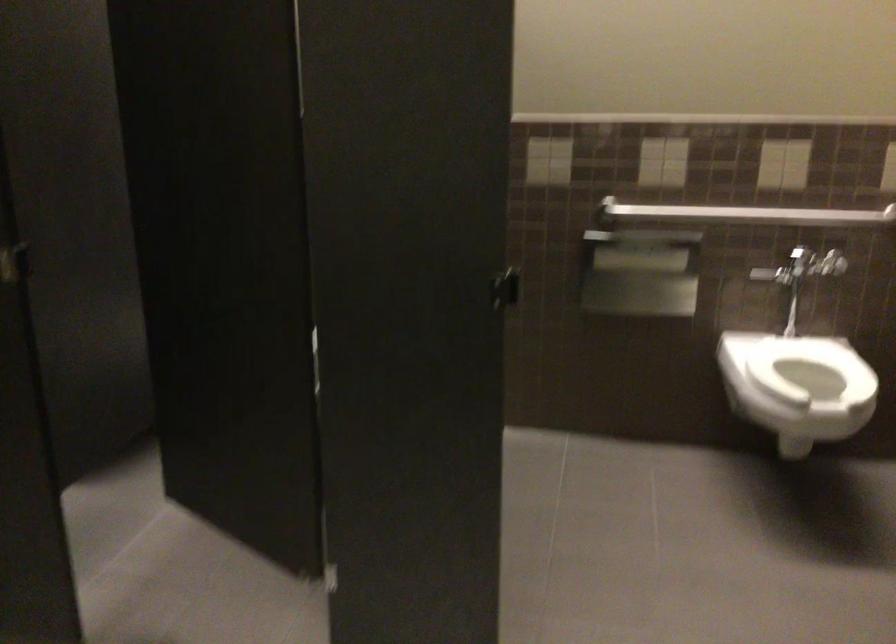
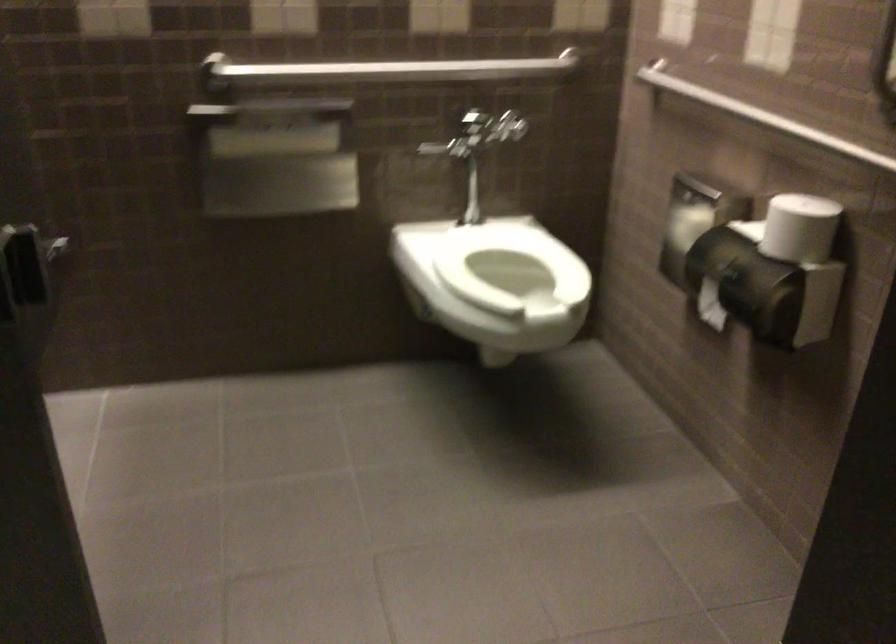
The point at (644,261) is marked in the first image. Where is the corresponding point in the second image?

(273, 143)